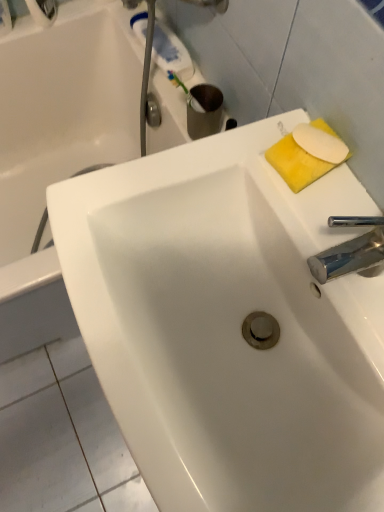
Where is `white glossy sink at center`? white glossy sink at center is located at coordinates (228, 325).

What do you see at coordinates (228, 325) in the screenshot?
I see `white glossy sink at center` at bounding box center [228, 325].

Locate an element on the screen. yellow sponge at upper right, placed as the 1th soap when sorted from back to front is located at coordinates (296, 163).

Measure the distance between point (45, 280) and camera.

Point (45, 280) and camera are 84.30 centimeters apart.

Locate an element on the screen. white glossy sink at center is located at coordinates (228, 325).

Would you say metallic knob at upper center is outside yellow sponge at upper right, placed as the 1th soap when sorted from back to front?

Yes, metallic knob at upper center is outside of yellow sponge at upper right, placed as the 1th soap when sorted from back to front.

Which object is positioned more to the right, metallic knob at upper center or yellow sponge at upper right, which ranks as the second soap in front-to-back order?

yellow sponge at upper right, which ranks as the second soap in front-to-back order, is more to the right.

From a real-world perspective, which object stands above the other?

From a 3D spatial view, yellow sponge at upper right, placed as the 1th soap when sorted from back to front, is above.

Looking at this image, which object is closer to the camera, yellow sponge at upper right, which ranks as the second soap in front-to-back order, or white matte soap at upper right, positioned as the first soap in front-to-back order?

white matte soap at upper right, positioned as the first soap in front-to-back order.

From the image's perspective, would you say yellow sponge at upper right, which ranks as the second soap in front-to-back order, is positioned over white matte soap at upper right, positioned as the 2th soap in back-to-front order?

No, from the image's perspective, yellow sponge at upper right, which ranks as the second soap in front-to-back order, is not above white matte soap at upper right, positioned as the 2th soap in back-to-front order.

Can you confirm if yellow sponge at upper right, which ranks as the second soap in front-to-back order, is bigger than white matte soap at upper right, positioned as the first soap in front-to-back order?

Yes.

From a real-world perspective, does yellow sponge at upper right, placed as the 1th soap when sorted from back to front, stand above white matte soap at upper right, positioned as the first soap in front-to-back order?

No.

Is white glossy bathtub at upper left looking in the opposite direction of white matte soap at upper right, positioned as the 2th soap in back-to-front order?

No, white matte soap at upper right, positioned as the 2th soap in back-to-front order, is not at the back of white glossy bathtub at upper left.

Considering the relative sizes of white glossy bathtub at upper left and white matte soap at upper right, positioned as the 2th soap in back-to-front order, in the image provided, is white glossy bathtub at upper left shorter than white matte soap at upper right, positioned as the 2th soap in back-to-front order,?

Incorrect, the height of white glossy bathtub at upper left does not fall short of that of white matte soap at upper right, positioned as the 2th soap in back-to-front order.

Is white glossy bathtub at upper left located outside white matte soap at upper right, positioned as the 2th soap in back-to-front order?

Indeed, white glossy bathtub at upper left is completely outside white matte soap at upper right, positioned as the 2th soap in back-to-front order.

Consider the image. Is white glossy bathtub at upper left in contact with white matte soap at upper right, positioned as the 2th soap in back-to-front order?

No, white glossy bathtub at upper left is not beside white matte soap at upper right, positioned as the 2th soap in back-to-front order.

Which object is further away from the camera, white matte soap at upper right, positioned as the first soap in front-to-back order, or white glossy sink at center?

white matte soap at upper right, positioned as the first soap in front-to-back order, is further away from the camera.

Is white matte soap at upper right, positioned as the 2th soap in back-to-front order, placed right next to white glossy sink at center?

No, white matte soap at upper right, positioned as the 2th soap in back-to-front order, is not touching white glossy sink at center.

From the image's perspective, is white matte soap at upper right, positioned as the 2th soap in back-to-front order, above or below white glossy sink at center?

Clearly, from the image's perspective, white matte soap at upper right, positioned as the 2th soap in back-to-front order, is above white glossy sink at center.

Is white matte soap at upper right, positioned as the first soap in front-to-back order, oriented away from white glossy sink at center?

white matte soap at upper right, positioned as the first soap in front-to-back order, does not have its back to white glossy sink at center.

From a real-world perspective, which object stands above the other?

From a 3D spatial view, white glossy sink at center is above.

From the image's perspective, does white glossy bathtub at upper left appear lower than white glossy sink at center?

Actually, white glossy bathtub at upper left appears above white glossy sink at center in the image.

In the image, is white glossy bathtub at upper left positioned in front of or behind white glossy sink at center?

white glossy bathtub at upper left is behind white glossy sink at center.

Is white glossy bathtub at upper left oriented towards white glossy sink at center?

No, white glossy bathtub at upper left is not oriented towards white glossy sink at center.

Can you confirm if white glossy bathtub at upper left is shorter than metallic knob at upper center?

Incorrect, the height of white glossy bathtub at upper left does not fall short of that of metallic knob at upper center.

Consider the image. Is white glossy bathtub at upper left inside or outside of metallic knob at upper center?

white glossy bathtub at upper left is spatially situated outside metallic knob at upper center.

Can you confirm if white glossy bathtub at upper left is positioned to the right of metallic knob at upper center?

In fact, white glossy bathtub at upper left is to the left of metallic knob at upper center.

Considering the positions of objects white glossy bathtub at upper left and metallic knob at upper center in the image provided, who is behind, white glossy bathtub at upper left or metallic knob at upper center?

metallic knob at upper center is behind.

Considering the sizes of objects yellow sponge at upper right, placed as the 1th soap when sorted from back to front, and metallic knob at upper center in the image provided, who is thinner, yellow sponge at upper right, placed as the 1th soap when sorted from back to front, or metallic knob at upper center?

metallic knob at upper center.

This screenshot has height=512, width=384. Find the location of `soap that is the 1st one when counting rightward from the metallic knob at upper center`. soap that is the 1st one when counting rightward from the metallic knob at upper center is located at coordinates (296, 163).

From a real-world perspective, which object rests below the other?

In real-world perspective, metallic knob at upper center is lower.

Locate an element on the screen. This screenshot has width=384, height=512. plumbing fixture that is on the left side of yellow sponge at upper right, which ranks as the second soap in front-to-back order is located at coordinates (152, 111).

Where is `soap that appears behind the white matte soap at upper right, positioned as the first soap in front-to-back order`? Image resolution: width=384 pixels, height=512 pixels. soap that appears behind the white matte soap at upper right, positioned as the first soap in front-to-back order is located at coordinates (296, 163).

From the image, which object appears to be nearer to white glossy bathtub at upper left, metallic knob at upper center or white glossy sink at center?

metallic knob at upper center is closer to white glossy bathtub at upper left.

Estimate the real-world distances between objects in this image. Which object is further from white glossy sink at center, metallic knob at upper center or white glossy bathtub at upper left?

The object further to white glossy sink at center is metallic knob at upper center.

Considering their positions, is white matte soap at upper right, positioned as the first soap in front-to-back order, positioned further to white glossy sink at center than yellow sponge at upper right, which ranks as the second soap in front-to-back order?

white matte soap at upper right, positioned as the first soap in front-to-back order.

From the image, which object appears to be nearer to white glossy sink at center, white matte soap at upper right, positioned as the 2th soap in back-to-front order, or metallic knob at upper center?

The object closer to white glossy sink at center is white matte soap at upper right, positioned as the 2th soap in back-to-front order.

Considering their positions, is white glossy bathtub at upper left positioned further to white matte soap at upper right, positioned as the first soap in front-to-back order, than white glossy sink at center?

The object further to white matte soap at upper right, positioned as the first soap in front-to-back order, is white glossy bathtub at upper left.

Estimate the real-world distances between objects in this image. Which object is closer to white glossy bathtub at upper left, white matte soap at upper right, positioned as the 2th soap in back-to-front order, or metallic knob at upper center?

Among the two, metallic knob at upper center is located nearer to white glossy bathtub at upper left.

From the image, which object appears to be farther from yellow sponge at upper right, placed as the 1th soap when sorted from back to front, white glossy bathtub at upper left or white glossy sink at center?

white glossy bathtub at upper left is further to yellow sponge at upper right, placed as the 1th soap when sorted from back to front.

From the image, which object appears to be nearer to white matte soap at upper right, positioned as the first soap in front-to-back order, metallic knob at upper center or white glossy sink at center?

Among the two, white glossy sink at center is located nearer to white matte soap at upper right, positioned as the first soap in front-to-back order.

The width and height of the screenshot is (384, 512). I want to click on soap that lies between white matte soap at upper right, positioned as the 2th soap in back-to-front order, and white glossy sink at center from top to bottom, so click(x=296, y=163).

This screenshot has width=384, height=512. In order to click on plumbing fixture between white glossy bathtub at upper left and white matte soap at upper right, positioned as the first soap in front-to-back order, from left to right in this screenshot , I will do `click(152, 111)`.

Where is `bathtub located between white glossy sink at center and metallic knob at upper center in the depth direction`? The width and height of the screenshot is (384, 512). bathtub located between white glossy sink at center and metallic knob at upper center in the depth direction is located at coordinates (64, 147).

What are the coordinates of `sink between white glossy bathtub at upper left and white matte soap at upper right, positioned as the first soap in front-to-back order, from left to right` in the screenshot? It's located at (228, 325).